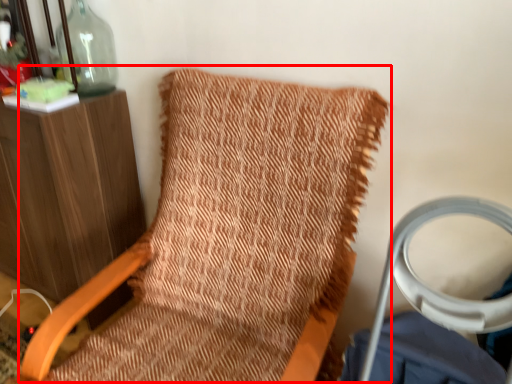
Question: From the image's perspective, what is the correct spatial relationship of bean bag chair (annotated by the red box) in relation to bottle?

Choices:
 (A) above
 (B) below

Answer: (B)